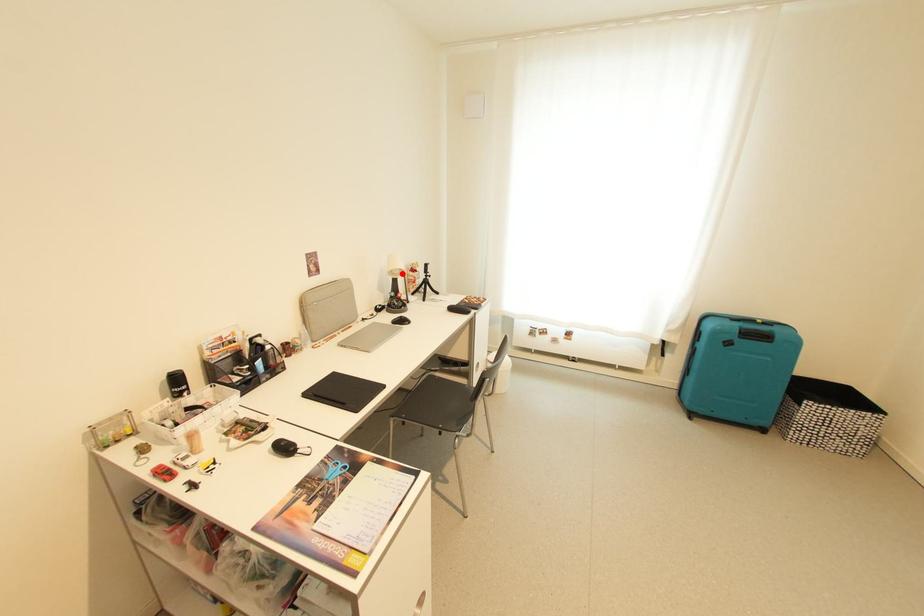
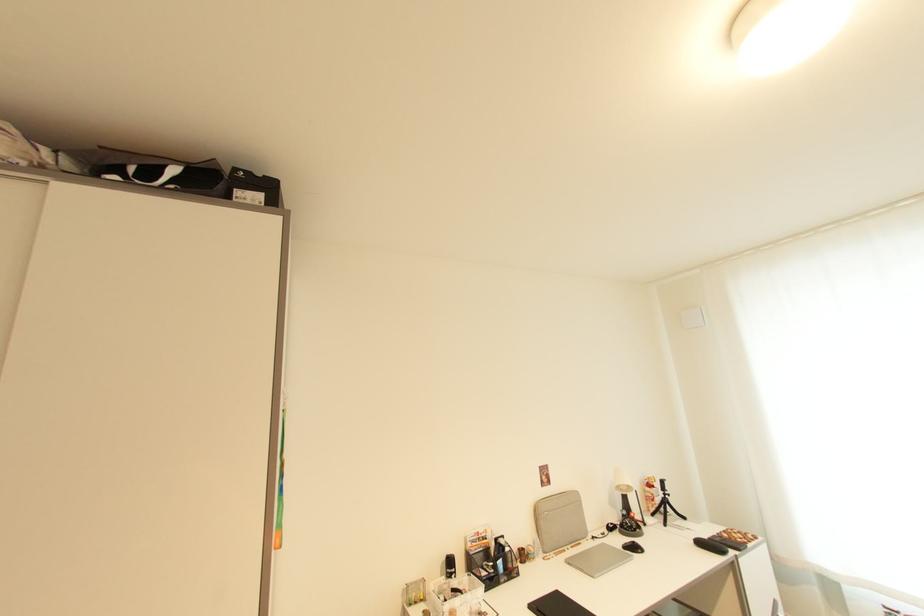
Question: I am providing you with two images of the same scene from different viewpoints. A red point is shown in image1. For the corresponding object point in image2, is it positioned nearer or farther from the camera?

Choices:
 (A) Nearer
 (B) Farther

Answer: (B)